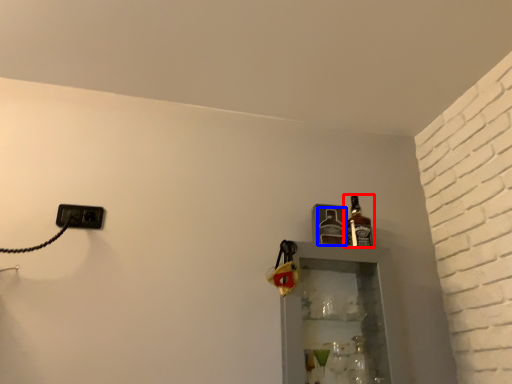
Question: Which of the following is the closest to the observer, bottle (highlighted by a red box) or bottle (highlighted by a blue box)?

Choices:
 (A) bottle
 (B) bottle

Answer: (A)